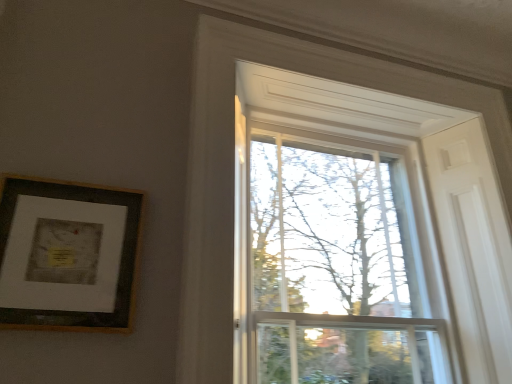
Question: Visually, is wooden framed print at upper left positioned to the left or to the right of clear glass window at upper center?

Choices:
 (A) right
 (B) left

Answer: (B)

Question: Relative to clear glass window at upper center, is wooden framed print at upper left in front or behind?

Choices:
 (A) behind
 (B) front

Answer: (B)

Question: From the image's perspective, is wooden framed print at upper left above or below clear glass window at upper center?

Choices:
 (A) below
 (B) above

Answer: (B)

Question: Considering the positions of clear glass window at upper center and wooden framed print at upper left in the image, is clear glass window at upper center bigger or smaller than wooden framed print at upper left?

Choices:
 (A) small
 (B) big

Answer: (B)

Question: From a real-world perspective, is clear glass window at upper center above or below wooden framed print at upper left?

Choices:
 (A) below
 (B) above

Answer: (B)

Question: Which is correct: clear glass window at upper center is inside wooden framed print at upper left, or outside of it?

Choices:
 (A) inside
 (B) outside

Answer: (B)

Question: From their relative heights in the image, would you say clear glass window at upper center is taller or shorter than wooden framed print at upper left?

Choices:
 (A) short
 (B) tall

Answer: (B)